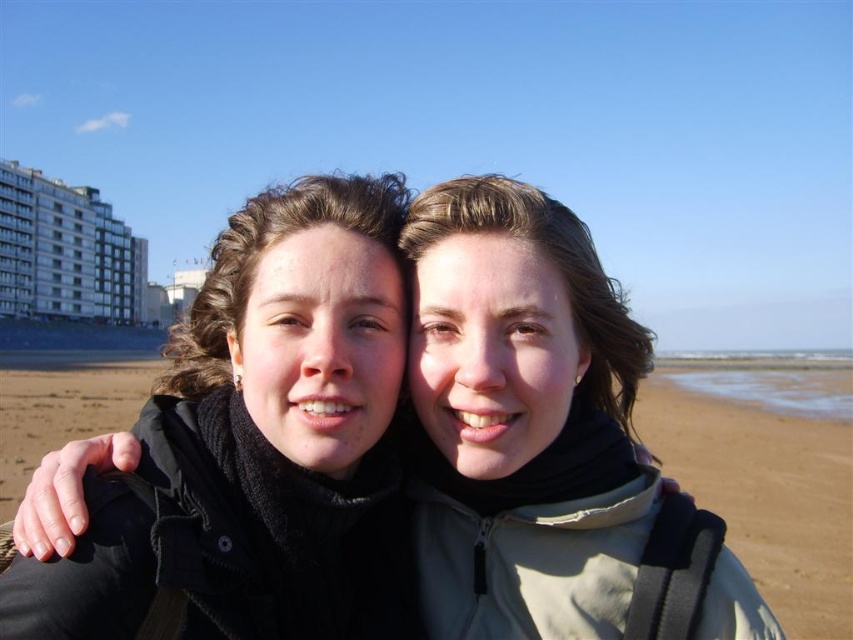
Question: Is black matte jacket at left above matte black jacket at center?

Choices:
 (A) no
 (B) yes

Answer: (B)

Question: Which of the following is the closest to the observer?

Choices:
 (A) (650, 422)
 (B) (489, 625)
 (C) (241, 243)

Answer: (B)

Question: Is black matte jacket at left below matte black jacket at center?

Choices:
 (A) no
 (B) yes

Answer: (A)

Question: Which object is farther from the camera taking this photo?

Choices:
 (A) matte black jacket at center
 (B) brown sand at center
 (C) black matte jacket at left

Answer: (B)

Question: Which object appears farthest from the camera in this image?

Choices:
 (A) brown sand at center
 (B) matte black jacket at center
 (C) black matte jacket at left

Answer: (A)

Question: Does matte black jacket at center have a greater width compared to brown sand at center?

Choices:
 (A) yes
 (B) no

Answer: (B)